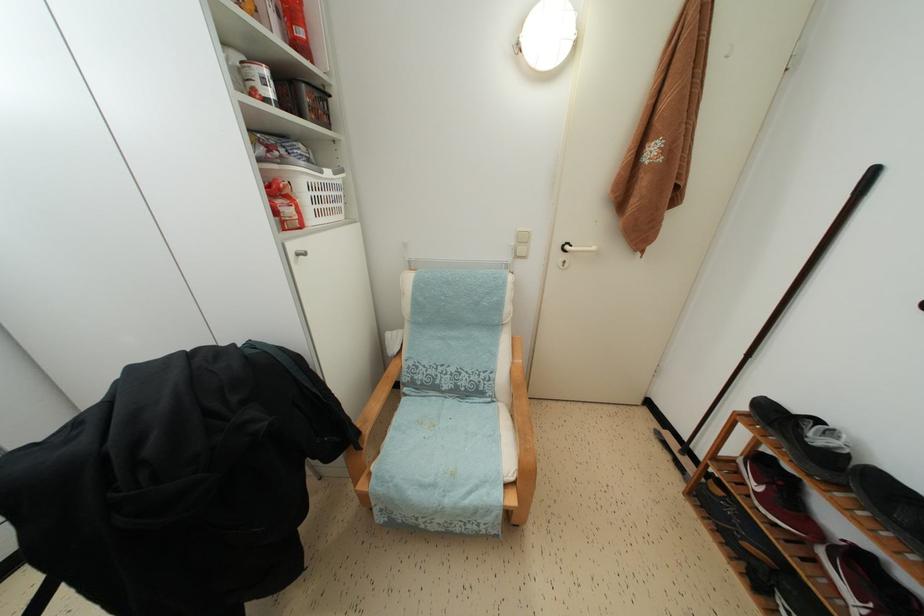
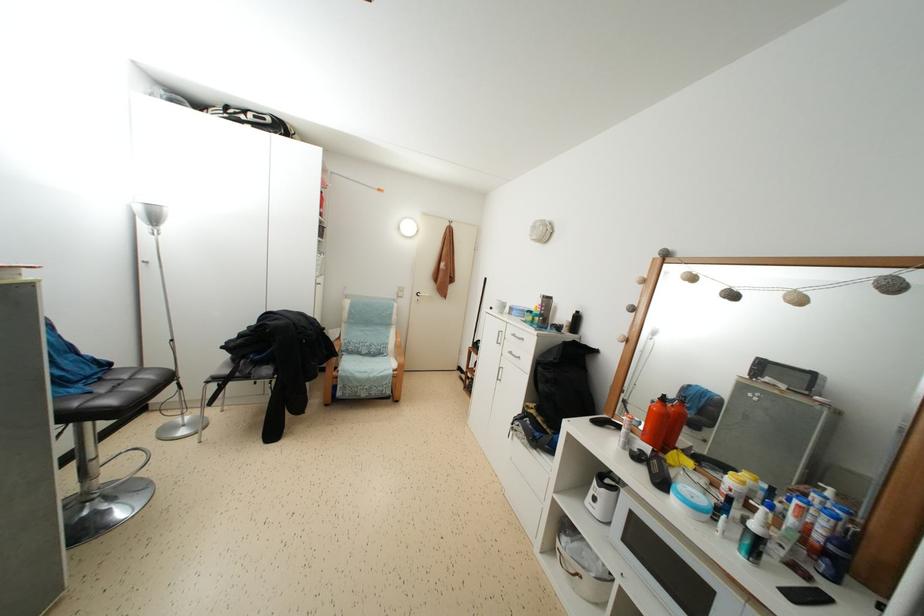
Question: I am providing you with two images of the same scene from different viewpoints. Please identify which objects are invisible in image2.

Choices:
 (A) black luggage case
 (B) black chair sitting surface
 (C) gray chair sitting surface
 (D) black shoe

Answer: (D)